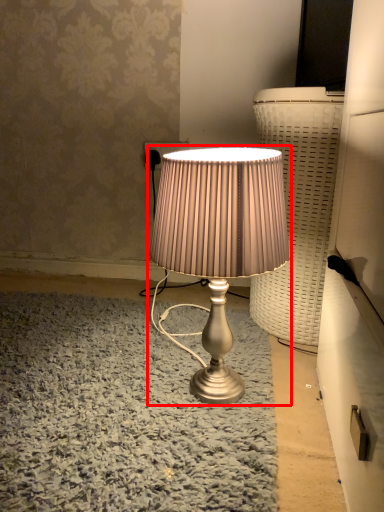
Question: From the image's perspective, considering the relative positions of lamp (annotated by the red box) and electric outlet in the image provided, where is lamp (annotated by the red box) located with respect to the staircase?

Choices:
 (A) below
 (B) above

Answer: (A)